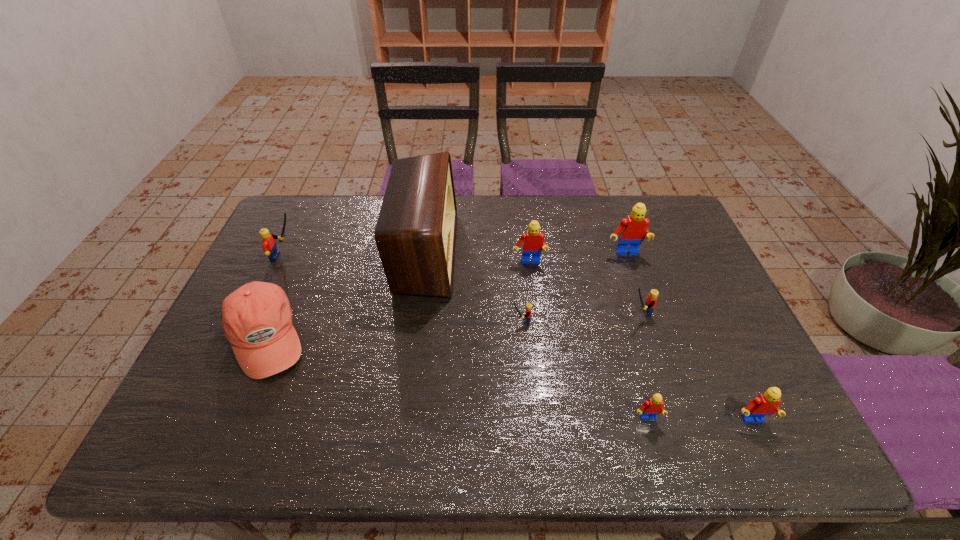
Where is `free spot between the smallest red Lego and the tallest object`? This screenshot has height=540, width=960. free spot between the smallest red Lego and the tallest object is located at coordinates (536, 335).

Find the location of a particular element. The image size is (960, 540). vacant area that lies between the third smallest red Lego and the biggest red Lego is located at coordinates (577, 258).

The width and height of the screenshot is (960, 540). In order to click on vacant space that's between the rightmost object and the smallest red Lego in this screenshot , I will do point(699,420).

Locate an element on the screen. The width and height of the screenshot is (960, 540). free spot between the baseball cap and the third smallest red Lego is located at coordinates tap(396, 300).

You are a GUI agent. You are given a task and a screenshot of the screen. Output one action in this format:
    pyautogui.click(x=<x>, y=<y>)
    Task: Click on the free point between the leftmost red Lego and the second tallest object
    The height and width of the screenshot is (540, 960).
    Given the screenshot: What is the action you would take?
    tap(577, 258)

Find the location of `object that can be found as the closest to the biggest red Lego`. object that can be found as the closest to the biggest red Lego is located at coordinates (650, 302).

Locate an element on the screen. object that is the fifth nearest to the second yellow Lego from right to left is located at coordinates (632, 230).

Identify which Lego is the fifth nearest to the tallest Lego. Please provide its 2D coordinates. Your answer should be formatted as a tuple, i.e. [(x, y)], where the tuple contains the x and y coordinates of a point satisfying the conditions above.

[(766, 404)]

This screenshot has width=960, height=540. In order to click on the second closest Lego to the farthest yellow Lego in this screenshot , I will do `click(528, 306)`.

Identify the location of the second closest red Lego to the third object from left to right. The image size is (960, 540). (632, 230).